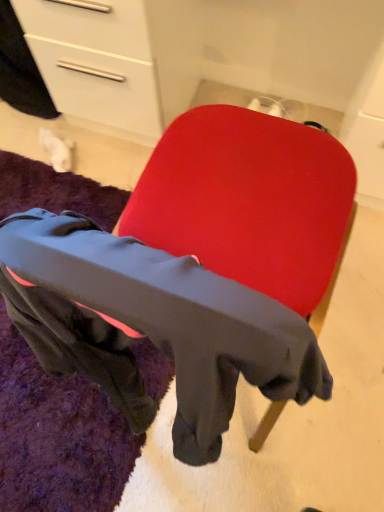
Question: From a real-world perspective, is black fleece mat at lower left above or below matte red chair at center?

Choices:
 (A) below
 (B) above

Answer: (A)

Question: Considering their positions, is black fleece mat at lower left located in front of or behind matte red chair at center?

Choices:
 (A) behind
 (B) front

Answer: (A)

Question: Is black fleece mat at lower left wider or thinner than matte red chair at center?

Choices:
 (A) wide
 (B) thin

Answer: (A)

Question: Is matte red chair at center wider or thinner than black fleece mat at lower left?

Choices:
 (A) wide
 (B) thin

Answer: (B)

Question: In terms of height, does matte red chair at center look taller or shorter compared to black fleece mat at lower left?

Choices:
 (A) tall
 (B) short

Answer: (A)

Question: Do you think matte red chair at center is within black fleece mat at lower left, or outside of it?

Choices:
 (A) outside
 (B) inside

Answer: (A)

Question: Is point (223, 151) closer or farther from the camera than point (122, 193)?

Choices:
 (A) farther
 (B) closer

Answer: (B)